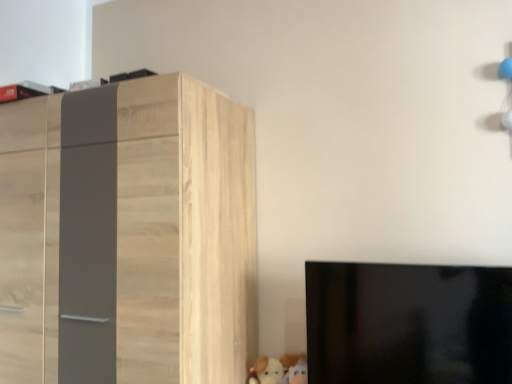
Locate an element on the screen. The image size is (512, 384). plush toy at lower right is located at coordinates (294, 368).

In order to face plush toy at lower right, should I rotate leftwards or rightwards?

You should look right and rotate roughly 5.895 degrees.

This screenshot has height=384, width=512. What do you see at coordinates (294, 368) in the screenshot?
I see `plush toy at lower right` at bounding box center [294, 368].

The width and height of the screenshot is (512, 384). I want to click on plush toy at lower right, so click(294, 368).